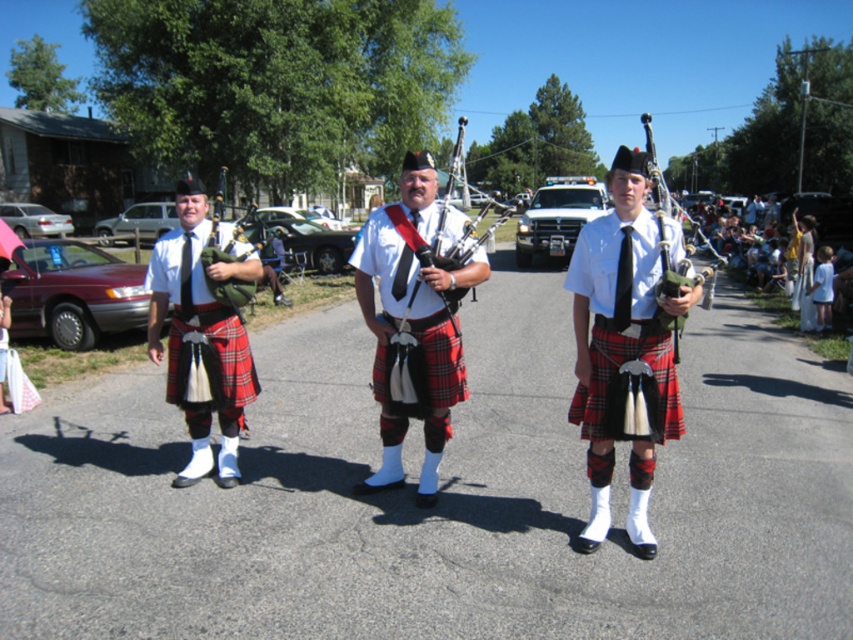
Question: Is red plaid kilt at center wider than matte black bagpipes at center?

Choices:
 (A) yes
 (B) no

Answer: (B)

Question: Which point is closer to the camera?

Choices:
 (A) red plaid kilt at center
 (B) matte black kilt at center
 (C) matte black kilt at left
 (D) matte green bagpipes at center

Answer: (A)

Question: Can you confirm if red plaid kilt at center is positioned to the left of matte black kilt at center?

Choices:
 (A) yes
 (B) no

Answer: (B)

Question: Which object is positioned closest to the matte green bagpipes at center?

Choices:
 (A) red plaid kilt at center
 (B) matte black kilt at left
 (C) matte black bagpipes at center

Answer: (A)

Question: Can you confirm if matte black kilt at center is positioned to the right of matte black bagpipes at center?

Choices:
 (A) yes
 (B) no

Answer: (B)

Question: Which of the following is the farthest from the observer?

Choices:
 (A) matte black kilt at left
 (B) matte black kilt at center
 (C) red plaid kilt at center
 (D) matte green bagpipes at center

Answer: (A)